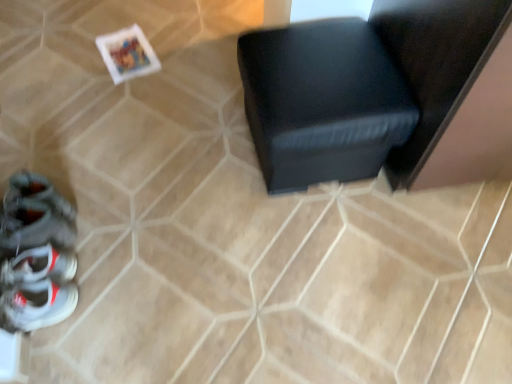
Question: From a real-world perspective, is shiny gray sneaker at lower left above or below black leather ottoman at center?

Choices:
 (A) above
 (B) below

Answer: (B)

Question: Is shiny gray sneaker at lower left situated inside black leather ottoman at center or outside?

Choices:
 (A) outside
 (B) inside

Answer: (A)

Question: Estimate the real-world distances between objects in this image. Which object is closer to the white leather sneakers at lower left?

Choices:
 (A) shiny gray sneaker at lower left
 (B) black leather ottoman at center

Answer: (A)

Question: Which is nearer to the white leather sneakers at lower left?

Choices:
 (A) black leather ottoman at center
 (B) shiny gray sneaker at lower left

Answer: (B)